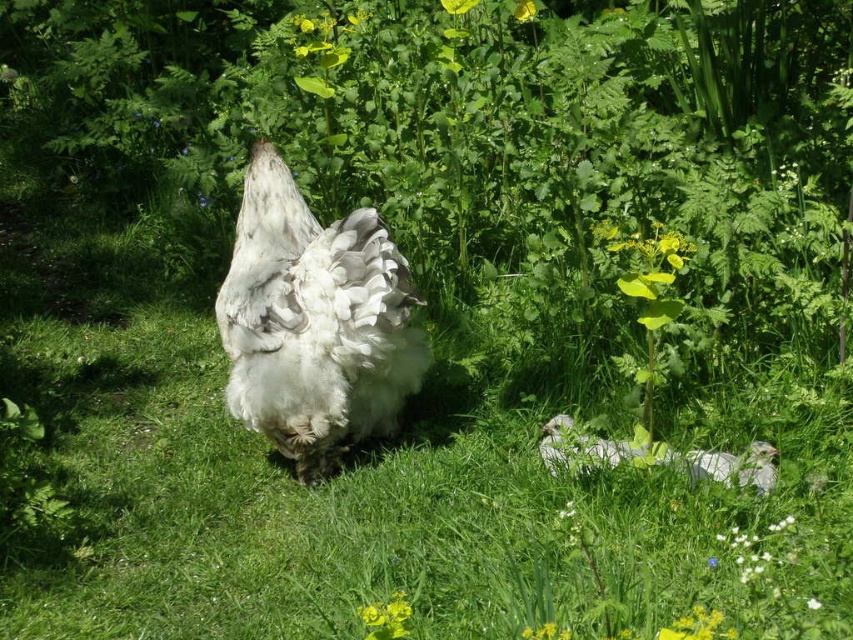
Question: Which of the following is the farthest from the observer?

Choices:
 (A) (409, 368)
 (B) (578, 436)

Answer: (A)

Question: Can you confirm if white fluffy chicken at center is bigger than white fluffy chicken at lower center?

Choices:
 (A) no
 (B) yes

Answer: (B)

Question: Is white fluffy chicken at center to the left of white fluffy chicken at lower center from the viewer's perspective?

Choices:
 (A) no
 (B) yes

Answer: (B)

Question: Among these objects, which one is nearest to the camera?

Choices:
 (A) white fluffy chicken at lower center
 (B) white fluffy chicken at center

Answer: (A)

Question: Is white fluffy chicken at center wider than white fluffy chicken at lower center?

Choices:
 (A) yes
 (B) no

Answer: (B)

Question: Which object is closer to the camera taking this photo?

Choices:
 (A) white fluffy chicken at center
 (B) white fluffy chicken at lower center

Answer: (B)